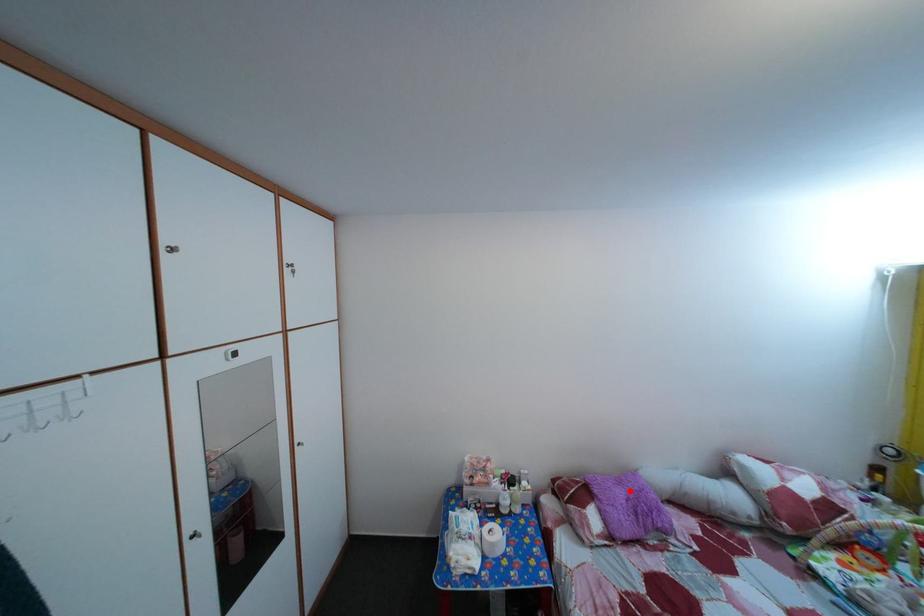
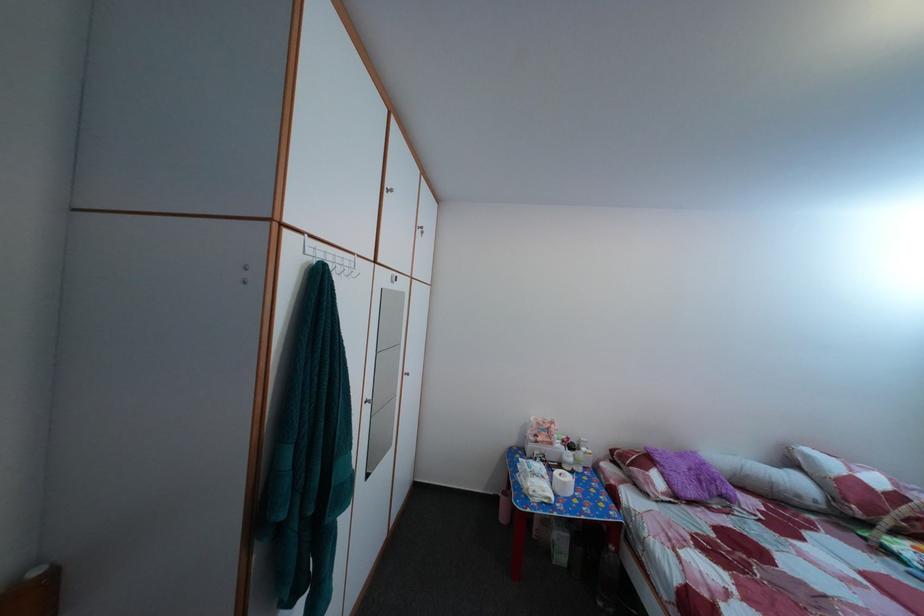
Locate, in the second image, the point that corresponds to the highlighted location in the first image.

(689, 464)